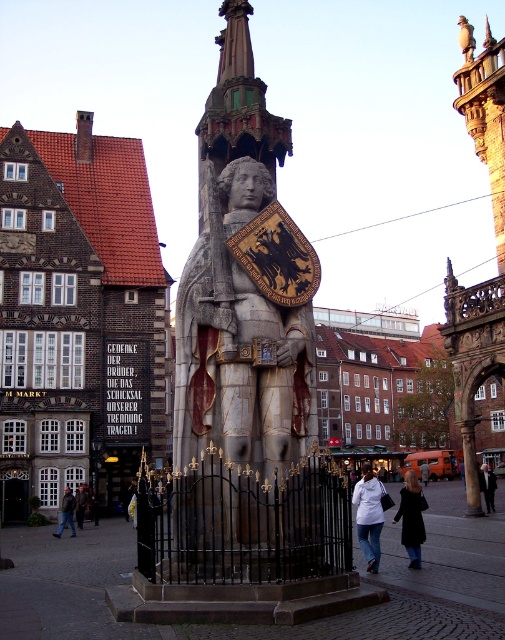
Looking at this image, you are a tourist standing in front of the historical monument and notice two leather items on the ground. Which one is closer to you, the black leather coat at lower right or the dark brown leather jacket at lower left?

The black leather coat at lower right is closer to you because it is in front of the dark brown leather jacket at lower left.

You are a tourist standing in front of the historical monument. You notice a black leather coat at lower right and dark blue jeans at lower left. Which item is closer to you, the tourist?

The black leather coat at lower right is closer to you because it is in front of the dark blue jeans at lower left.